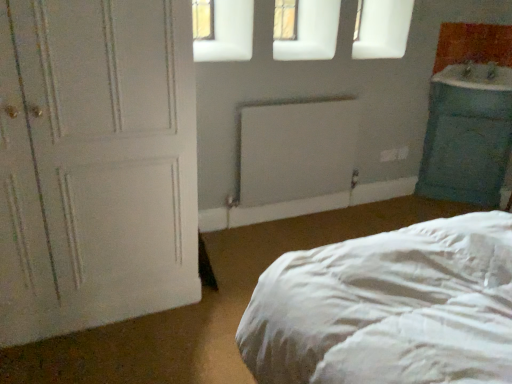
Image resolution: width=512 pixels, height=384 pixels. In order to click on free space to the right of white matte door at left in this screenshot , I will do `click(220, 294)`.